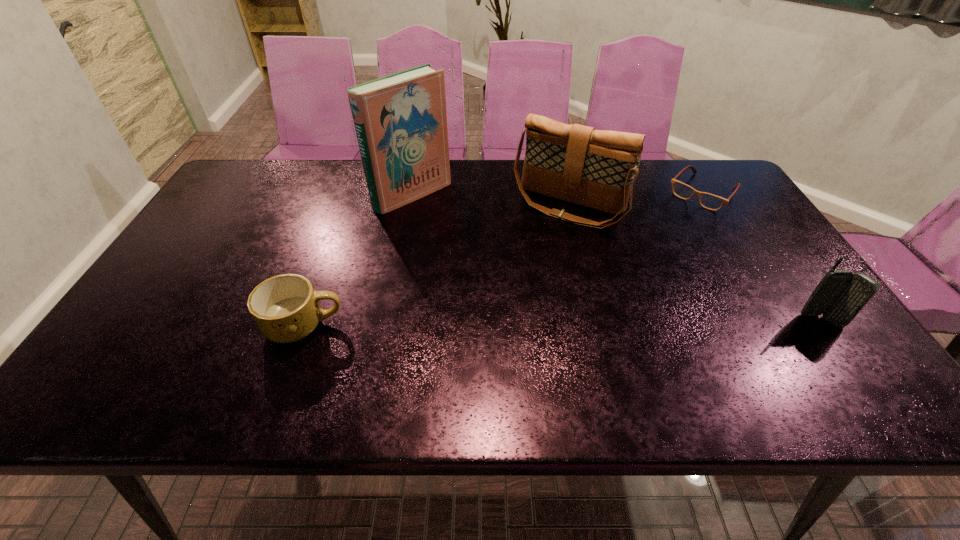
Where is `the second shortest object`? This screenshot has width=960, height=540. the second shortest object is located at coordinates (286, 308).

Where is `the third tallest object`? This screenshot has height=540, width=960. the third tallest object is located at coordinates (840, 295).

This screenshot has width=960, height=540. In order to click on the second tallest object in this screenshot , I will do `click(575, 163)`.

Image resolution: width=960 pixels, height=540 pixels. Identify the location of shoulder bag. (575, 163).

Find the location of a particular element. hardback book is located at coordinates (400, 120).

Identify the location of the shortest object. This screenshot has width=960, height=540. (709, 201).

This screenshot has width=960, height=540. In order to click on vacant region located on the side with the handle of the mug in this screenshot , I will do `click(370, 326)`.

This screenshot has width=960, height=540. Find the location of `free space located on the keyboard of the cellular telephone`. free space located on the keyboard of the cellular telephone is located at coordinates (841, 349).

This screenshot has width=960, height=540. Identify the location of blank space located on the front-facing side of the shoulder bag. point(488,323).

Where is `free location located 0.120m on the front-facing side of the shoulder bag`? This screenshot has height=540, width=960. free location located 0.120m on the front-facing side of the shoulder bag is located at coordinates (531, 255).